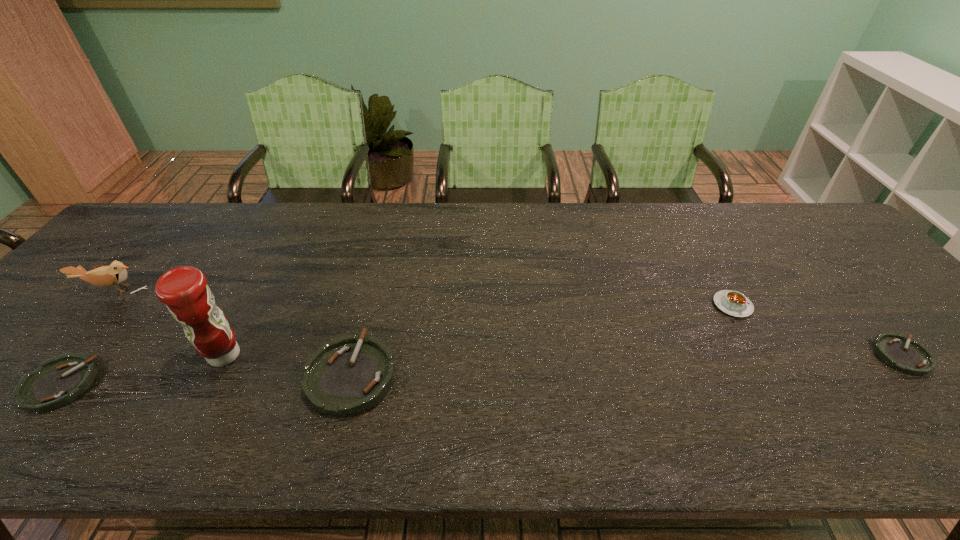
I want to click on the second shortest ashtray, so click(58, 381).

Locate an element on the screen. Image resolution: width=960 pixels, height=540 pixels. the fifth tallest object is located at coordinates (58, 381).

At what (x,y) coordinates should I click in order to perform the action: click on the second ashtray from left to right. Please return your answer as a coordinate pair (x, y). Image resolution: width=960 pixels, height=540 pixels. Looking at the image, I should click on (348, 375).

You are a GUI agent. You are given a task and a screenshot of the screen. Output one action in this format:
    pyautogui.click(x=<x>, y=<y>)
    Task: Click on the third object from right to left
    
    Given the screenshot: What is the action you would take?
    pyautogui.click(x=348, y=375)

Locate an element on the screen. This screenshot has width=960, height=540. the shortest ashtray is located at coordinates (910, 357).

Identify the location of the rightmost object. (910, 357).

Find the location of `the second object from right to left`. the second object from right to left is located at coordinates (734, 303).

This screenshot has width=960, height=540. I want to click on bird, so click(x=115, y=274).

You are a GUI agent. You are given a task and a screenshot of the screen. Output one action in this format:
    pyautogui.click(x=<x>, y=<y>)
    Task: Click on the fourth object from right to left
    The image size is (960, 540).
    Given the screenshot: What is the action you would take?
    pyautogui.click(x=184, y=290)

This screenshot has height=540, width=960. Find the location of `the tallest object`. the tallest object is located at coordinates (184, 290).